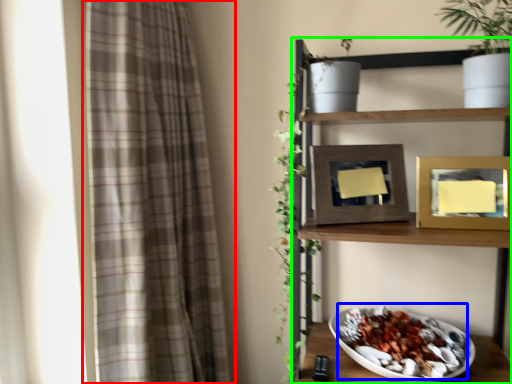
Question: Considering the real-world distances, which object is farthest from curtain (highlighted by a red box)? food (highlighted by a blue box) or shelf (highlighted by a green box)?

Choices:
 (A) food
 (B) shelf

Answer: (A)